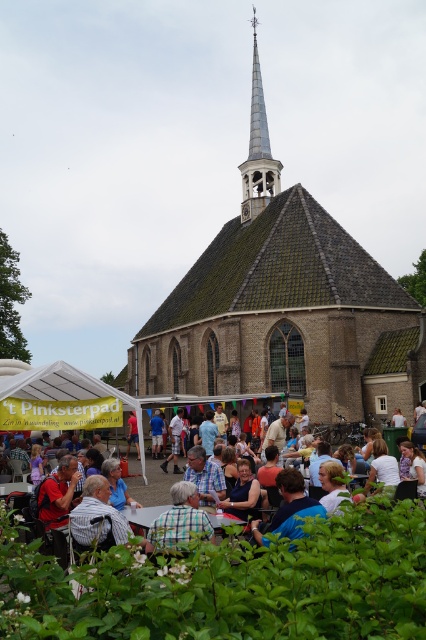
You are standing in front of the brown brick church at center and the blue plaid shirt at center. Which object is closer to you?

The brown brick church at center is closer to you than the blue plaid shirt at center.